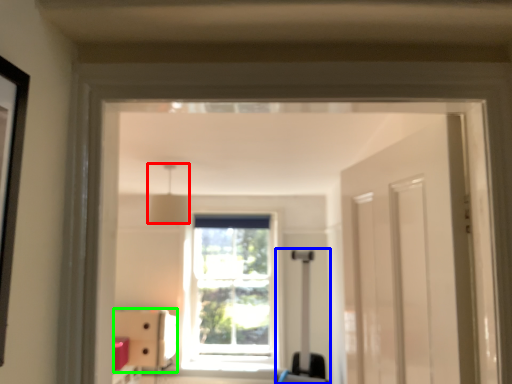
Question: Based on their relative distances, which object is farther from light fixture (highlighted by a red box)? Choose from luggage (highlighted by a blue box) and furniture (highlighted by a green box).

Choices:
 (A) luggage
 (B) furniture

Answer: (B)